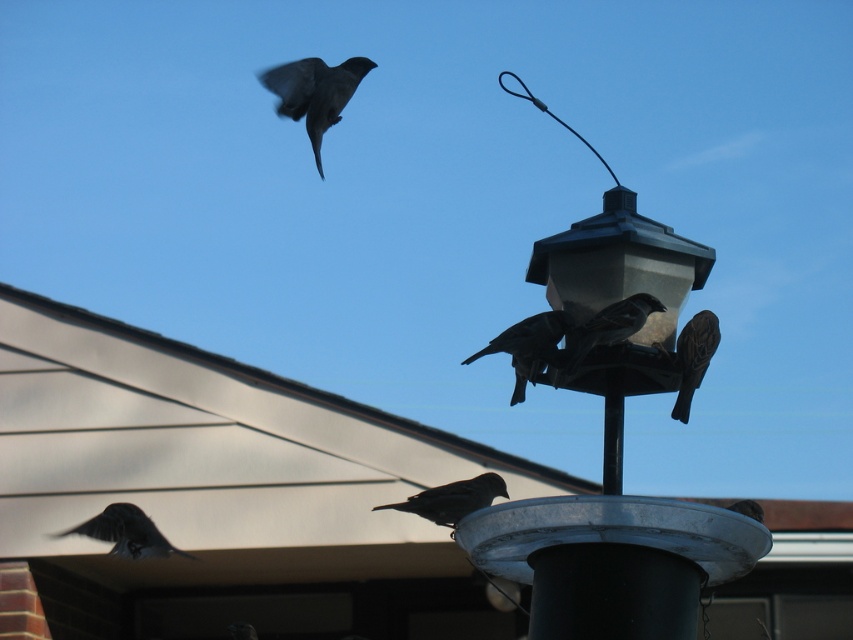
Question: Is metallic gray bird feeder at center in front of dark gray feathers at lower left?

Choices:
 (A) yes
 (B) no

Answer: (A)

Question: Which of the following is the closest to the observer?

Choices:
 (A) black matte pole at center
 (B) brown speckled bird at center
 (C) silhouette matte bird at center
 (D) dark gray feathers at lower left

Answer: (A)

Question: Which point is closer to the camera?

Choices:
 (A) black matte pole at center
 (B) dark gray feathers at lower left
 (C) metallic gray bird feeder at center

Answer: (C)

Question: Is silhouette matte bird at center above black matte pole at center?

Choices:
 (A) no
 (B) yes

Answer: (A)

Question: Among these objects, which one is nearest to the camera?

Choices:
 (A) silhouette glossy bird at upper left
 (B) dark gray feathers at lower left
 (C) dark brown feathers at center
 (D) silhouette matte bird at center

Answer: (C)

Question: Is dark gray feathers at lower left thinner than brown speckled bird at right?

Choices:
 (A) no
 (B) yes

Answer: (A)